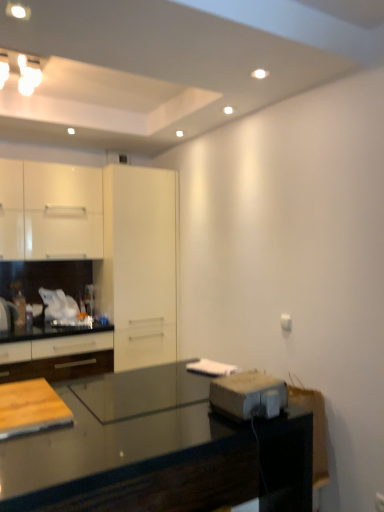
This screenshot has height=512, width=384. Identify the location of vacant space to the left of metallic gray toaster at lower right. (195, 409).